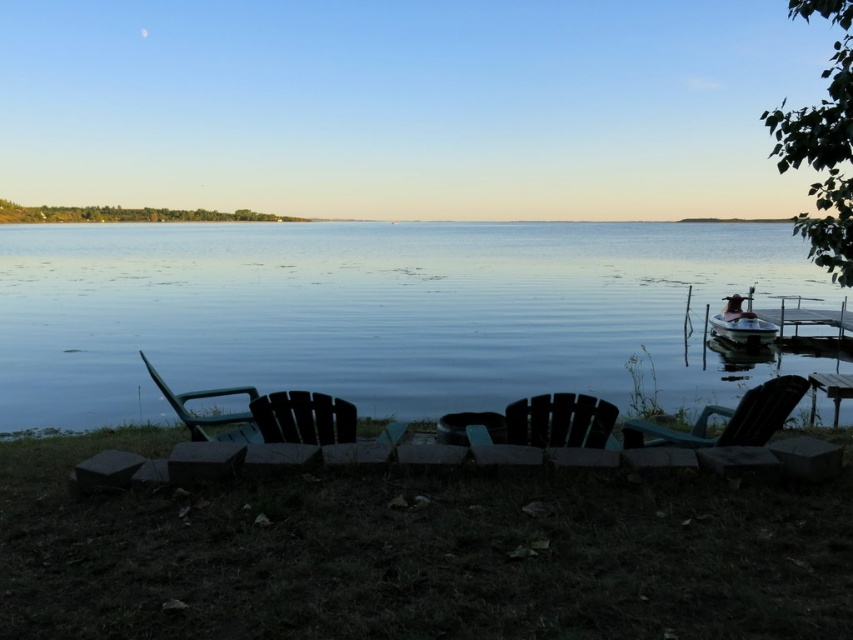
Question: In this image, where is green plastic chair at lower left located relative to wooden dock at right?

Choices:
 (A) left
 (B) right

Answer: (A)

Question: Among these objects, which one is farthest from the camera?

Choices:
 (A) wooden dock at right
 (B) metallic silver boat at right

Answer: (A)

Question: Which of the following is the closest to the observer?

Choices:
 (A) (397, 243)
 (B) (503, 420)
 (C) (718, 314)

Answer: (B)

Question: Observing the image, what is the correct spatial positioning of dark wood chair at center in reference to black wood chair at center?

Choices:
 (A) below
 (B) above

Answer: (A)

Question: Can you confirm if teal plastic chair at right is wider than green plastic chair at lower left?

Choices:
 (A) yes
 (B) no

Answer: (B)

Question: Among these objects, which one is farthest from the camera?

Choices:
 (A) blue water at center
 (B) wooden dock at right
 (C) teal plastic chair at right
 (D) black wood chair at center

Answer: (B)